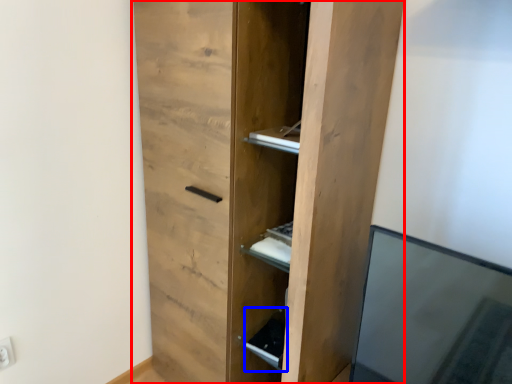
Question: Which object appears closest to the camera in this image, cupboard (highlighted by a red box) or cabinet (highlighted by a blue box)?

Choices:
 (A) cupboard
 (B) cabinet

Answer: (A)